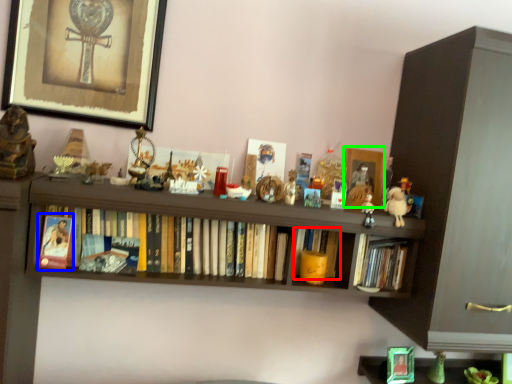
Question: Based on their relative distances, which object is farther from book (highlighted by a red box)? Choose from paperback book (highlighted by a blue box) and picture frame (highlighted by a green box).

Choices:
 (A) paperback book
 (B) picture frame

Answer: (A)